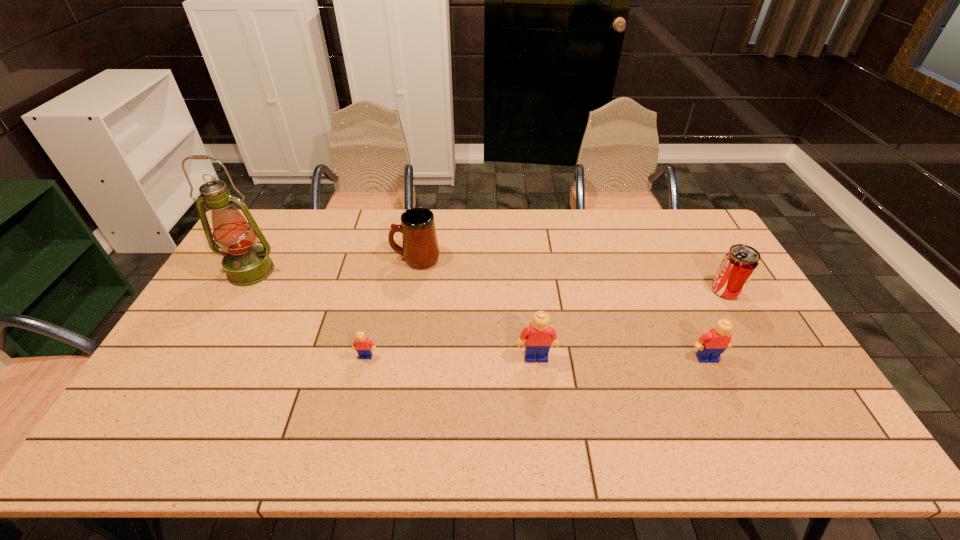
At what (x,y) coordinates should I click in order to perform the action: click on free space at the near edge of the desktop. Please return your answer as a coordinate pair (x, y). This screenshot has height=540, width=960. Looking at the image, I should click on (421, 388).

This screenshot has height=540, width=960. What are the coordinates of `vacant space at the left edge` in the screenshot? It's located at (275, 255).

Identify the location of vacant position at the right edge of the desktop. This screenshot has width=960, height=540. (755, 363).

This screenshot has height=540, width=960. I want to click on vacant space at the far left corner of the desktop, so click(264, 217).

This screenshot has width=960, height=540. I want to click on vacant space at the far right corner, so click(x=680, y=215).

The height and width of the screenshot is (540, 960). Identify the location of unoccupied position between the rightmost Lego and the third object from right to left. (621, 357).

In order to click on vacant space that's between the shortest object and the rightmost Lego in this screenshot , I will do `click(537, 357)`.

You are a GUI agent. You are given a task and a screenshot of the screen. Output one action in this format:
    pyautogui.click(x=<x>, y=<y>)
    Task: Click on the vacant space that is in between the mug and the shortest Lego
    This screenshot has height=540, width=960.
    Given the screenshot: What is the action you would take?
    pyautogui.click(x=391, y=307)

Where is `vacant area that lies between the fifth object from left to right and the leftmost Lego`? This screenshot has width=960, height=540. vacant area that lies between the fifth object from left to right and the leftmost Lego is located at coordinates (537, 357).

In order to click on vacant point located between the shortest object and the tallest object in this screenshot , I will do `click(308, 314)`.